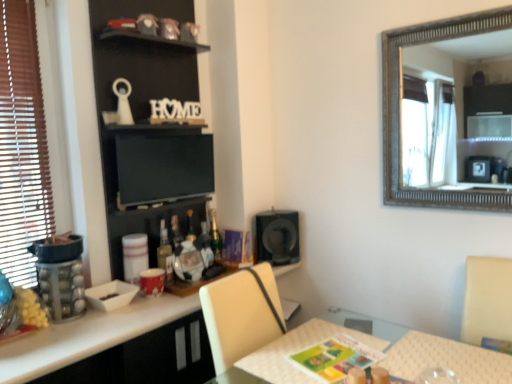
This screenshot has width=512, height=384. What do you see at coordinates (165, 255) in the screenshot?
I see `matte glass bottle at center, the second bottle viewed from the back` at bounding box center [165, 255].

Find the location of a particular element. Image resolution: width=512 pixels, height=384 pixels. black matte bookshelf at upper left is located at coordinates (148, 125).

Does point (106, 60) appear closer or farther from the camera than point (161, 247)?

Point (106, 60).

From the image's perspective, between black matte bookshelf at upper left and matte glass bottle at center, the second bottle viewed from the back, which one is located above?

black matte bookshelf at upper left.

How many degrees apart are the facing directions of black matte bookshelf at upper left and matte glass bottle at center, the first bottle in the left-to-right sequence?

They differ by 0.000879 degrees in their facing directions.

Does black matte bookshelf at upper left contain matte glass bottle at center, the second bottle viewed from the back?

Yes, matte glass bottle at center, the second bottle viewed from the back, is surrounded by black matte bookshelf at upper left.

From a real-world perspective, which is physically below, black glossy cabinet at lower center or black matte bookshelf at upper left?

black glossy cabinet at lower center.

Between black glossy cabinet at lower center and black matte bookshelf at upper left, which one has larger size?

With larger size is black glossy cabinet at lower center.

Which point is more distant from viewer, (6,365) or (165,42)?

The point (165,42) is farther.

Is black glossy cabinet at lower center facing away from black matte bookshelf at upper left?

black glossy cabinet at lower center does not have its back to black matte bookshelf at upper left.

Considering the sizes of objects matte glass bottle at center, the second bottle viewed from the back, and clear plastic container at left in the image provided, who is taller, matte glass bottle at center, the second bottle viewed from the back, or clear plastic container at left?

matte glass bottle at center, the second bottle viewed from the back, is taller.

Is matte glass bottle at center, the first bottle in the left-to-right sequence, facing towards clear plastic container at left?

No, matte glass bottle at center, the first bottle in the left-to-right sequence, is not turned towards clear plastic container at left.

Between matte glass bottle at center, the first bottle in the left-to-right sequence, and clear plastic container at left, which one has larger width?

Wider between the two is clear plastic container at left.

Considering the points (279, 264) and (180, 301), which point is behind, point (279, 264) or point (180, 301)?

Positioned behind is point (279, 264).

How far apart are black matte speaker at center and black glossy cabinet at lower center?

They are 30.47 inches apart.

Between black matte speaker at center and black glossy cabinet at lower center, which one has larger size?

black glossy cabinet at lower center is bigger.

Is black matte speaker at center placed right next to black glossy cabinet at lower center?

black matte speaker at center is not next to black glossy cabinet at lower center, and they're not touching.

Is clear plastic container at left next to green glass bottle at center, the 2th bottle viewed from the front?

No, clear plastic container at left is not beside green glass bottle at center, the 2th bottle viewed from the front.

Is the depth of clear plastic container at left greater than that of green glass bottle at center, which is counted as the first bottle, starting from the right?

No.

Which is farther, (50, 247) or (216, 249)?

The point (216, 249) is farther from the camera.

From the image's perspective, which one is positioned higher, clear plastic container at left or green glass bottle at center, the 1th bottle positioned from the back?

green glass bottle at center, the 1th bottle positioned from the back.

Between black glossy cabinet at lower center and green glass bottle at center, positioned as the second bottle in left-to-right order, which one has less height?

green glass bottle at center, positioned as the second bottle in left-to-right order, is shorter.

From the image's perspective, is black glossy cabinet at lower center below green glass bottle at center, positioned as the second bottle in left-to-right order?

Yes, from the image's perspective, black glossy cabinet at lower center is below green glass bottle at center, positioned as the second bottle in left-to-right order.

Is black glossy cabinet at lower center to the right of green glass bottle at center, positioned as the second bottle in left-to-right order, from the viewer's perspective?

Incorrect, black glossy cabinet at lower center is not on the right side of green glass bottle at center, positioned as the second bottle in left-to-right order.

Between black glossy cabinet at lower center and green glass bottle at center, which is counted as the first bottle, starting from the right, which one has larger width?

black glossy cabinet at lower center.

In the image, is clear plastic container at left positioned in front of or behind black matte bookshelf at upper left?

clear plastic container at left is positioned closer to the viewer than black matte bookshelf at upper left.

Between clear plastic container at left and black matte bookshelf at upper left, which one has smaller size?

clear plastic container at left is smaller.

The height and width of the screenshot is (384, 512). What are the coordinates of `appliance in front of the black matte bookshelf at upper left` in the screenshot? It's located at (60, 275).

Considering the relative sizes of clear plastic container at left and black matte bookshelf at upper left in the image provided, is clear plastic container at left shorter than black matte bookshelf at upper left?

Indeed, clear plastic container at left has a lesser height compared to black matte bookshelf at upper left.

Find the location of `bookshelf that is on the right side of matte glass bottle at center, the 1th bottle when ordered from front to back`. bookshelf that is on the right side of matte glass bottle at center, the 1th bottle when ordered from front to back is located at coordinates (148, 125).

What are the coordinates of `cabinetry that appears in front of the black matte bookshelf at upper left` in the screenshot? It's located at (87, 336).

Estimate the real-world distances between objects in this image. Which object is closer to black glossy cabinet at lower center, black matte speaker at center or green glass bottle at center, the 2th bottle viewed from the front?

The object closer to black glossy cabinet at lower center is green glass bottle at center, the 2th bottle viewed from the front.

Based on their spatial positions, is black matte bookshelf at upper left or clear plastic container at left closer to matte glass bottle at center, the first bottle in the left-to-right sequence?

Among the two, clear plastic container at left is located nearer to matte glass bottle at center, the first bottle in the left-to-right sequence.

Which object lies further to the anchor point green glass bottle at center, which is counted as the first bottle, starting from the right, black matte speaker at center or matte glass bottle at center, the second bottle viewed from the back?

Among the two, black matte speaker at center is located further to green glass bottle at center, which is counted as the first bottle, starting from the right.

Considering their positions, is green glass bottle at center, the 2th bottle viewed from the front, positioned closer to matte glass bottle at center, the first bottle in the left-to-right sequence, than black matte bookshelf at upper left?

green glass bottle at center, the 2th bottle viewed from the front.

Based on their spatial positions, is green glass bottle at center, the 1th bottle positioned from the back, or matte glass bottle at center, the first bottle in the left-to-right sequence, closer to clear plastic container at left?

matte glass bottle at center, the first bottle in the left-to-right sequence.

Considering their positions, is matte glass bottle at center, the 1th bottle when ordered from front to back, positioned further to black matte speaker at center than green glass bottle at center, which is counted as the first bottle, starting from the right?

Based on the image, matte glass bottle at center, the 1th bottle when ordered from front to back, appears to be further to black matte speaker at center.

Considering their positions, is black matte speaker at center positioned further to black matte bookshelf at upper left than clear plastic container at left?

The object further to black matte bookshelf at upper left is black matte speaker at center.

When comparing their distances from black matte speaker at center, does clear plastic container at left or matte glass bottle at center, the 1th bottle when ordered from front to back, seem closer?

matte glass bottle at center, the 1th bottle when ordered from front to back.

In order to click on bottle positioned between black glossy cabinet at lower center and black matte speaker at center from near to far in this screenshot , I will do click(165, 255).

This screenshot has height=384, width=512. I want to click on bottle between clear plastic container at left and green glass bottle at center, positioned as the second bottle in left-to-right order, from front to back, so (165, 255).

Where is `bottle between clear plastic container at left and black glossy cabinet at lower center`? This screenshot has height=384, width=512. bottle between clear plastic container at left and black glossy cabinet at lower center is located at coordinates (165, 255).

Locate an element on the screen. The image size is (512, 384). speaker between black glossy cabinet at lower center and green glass bottle at center, the 2th bottle viewed from the front, from front to back is located at coordinates (277, 237).